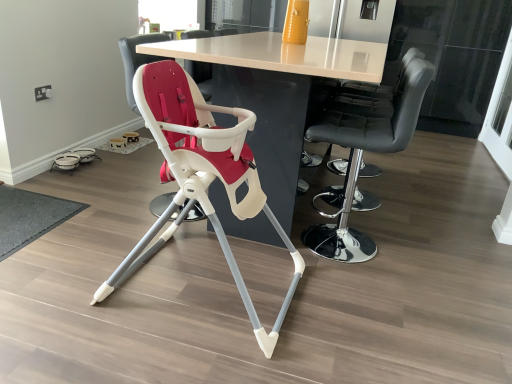
I want to click on free space that is in between matte plastic highchair at center, positioned as the 2th chair in right-to-left order, and black leather bar stool at right, positioned as the first chair in right-to-left order, so click(x=307, y=280).